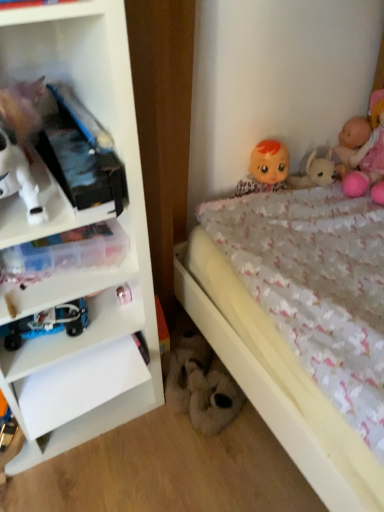
The image size is (384, 512). What do you see at coordinates (199, 384) in the screenshot? I see `fluffy white plush at lower center, the third toy when ordered from front to back` at bounding box center [199, 384].

Identify the location of metallic silver toy at lower left, marked as the 2th toy in a front-to-back arrangement. The width and height of the screenshot is (384, 512). 124,294.

What do you see at coordinates (124, 294) in the screenshot? I see `metallic silver toy at lower left, which appears as the second toy when viewed from the left` at bounding box center [124, 294].

The width and height of the screenshot is (384, 512). Describe the element at coordinates (350, 143) in the screenshot. I see `smooth pink doll at upper right, which is counted as the second doll, starting from the right` at that location.

What do you see at coordinates (266, 168) in the screenshot?
I see `smooth plastic doll at upper right, which is the 1th doll in left-to-right order` at bounding box center [266, 168].

Describe the element at coordinates (97, 265) in the screenshot. I see `white plastic shelf at left` at that location.

Measure the distance between white plastic shelf at left and camera.

They are 23.44 inches apart.

Identify the location of blue metallic car at lower left, arranged as the first toy when viewed from the left. The width and height of the screenshot is (384, 512). (47, 323).

Is metallic silver toy at lower left, the second toy from the right, turned away from smooth plastic doll at upper right, marked as the 3th doll in a right-to-left arrangement?

metallic silver toy at lower left, the second toy from the right, does not have its back to smooth plastic doll at upper right, marked as the 3th doll in a right-to-left arrangement.

Are metallic silver toy at lower left, the 3th toy from the bottom, and smooth plastic doll at upper right, which is the 1th doll in left-to-right order, beside each other?

No, metallic silver toy at lower left, the 3th toy from the bottom, is not in contact with smooth plastic doll at upper right, which is the 1th doll in left-to-right order.

Can you confirm if metallic silver toy at lower left, marked as the 2th toy in a front-to-back arrangement, is bigger than smooth plastic doll at upper right, marked as the 3th doll in a right-to-left arrangement?

Incorrect, metallic silver toy at lower left, marked as the 2th toy in a front-to-back arrangement, is not larger than smooth plastic doll at upper right, marked as the 3th doll in a right-to-left arrangement.

Is metallic silver toy at lower left, the second toy from the right, inside or outside of smooth plastic doll at upper right, which is the 1th doll in left-to-right order?

metallic silver toy at lower left, the second toy from the right, cannot be found inside smooth plastic doll at upper right, which is the 1th doll in left-to-right order.

Does point (119, 293) come farther from viewer compared to point (342, 151)?

No.

You are a GUI agent. You are given a task and a screenshot of the screen. Output one action in this format:
    pyautogui.click(x=<x>, y=<y>)
    Task: Click on the 1st toy positioned below the smooth pink doll at upper right, the second doll when ordered from left to right (from the image's perspective)
    The image size is (384, 512).
    Given the screenshot: What is the action you would take?
    pyautogui.click(x=124, y=294)

Which object is closer to the camera taking this photo, metallic silver toy at lower left, the 3th toy from the bottom, or smooth pink doll at upper right, which is counted as the second doll, starting from the right?

metallic silver toy at lower left, the 3th toy from the bottom, is in front.

In terms of height, does metallic silver toy at lower left, which appears as the second toy when viewed from the left, look taller or shorter compared to smooth pink doll at upper right, the second doll when ordered from left to right?

Considering their sizes, metallic silver toy at lower left, which appears as the second toy when viewed from the left, has less height than smooth pink doll at upper right, the second doll when ordered from left to right.

Is smooth pink doll at upper right, the second doll when ordered from left to right, with white plastic shelf at left?

No, smooth pink doll at upper right, the second doll when ordered from left to right, is not beside white plastic shelf at left.

Is smooth pink doll at upper right, the second doll when ordered from left to right, oriented towards white plastic shelf at left?

Yes, smooth pink doll at upper right, the second doll when ordered from left to right, is oriented towards white plastic shelf at left.

Which doll is the 3rd one when counting from the back of the white plastic shelf at left? Please provide its 2D coordinates.

[(350, 143)]

Where is `the 1st toy to the left of the smooth plastic doll at upper right, marked as the 3th doll in a right-to-left arrangement, starting your count from the anchor`? The width and height of the screenshot is (384, 512). the 1st toy to the left of the smooth plastic doll at upper right, marked as the 3th doll in a right-to-left arrangement, starting your count from the anchor is located at coordinates (199, 384).

Is smooth plastic doll at upper right, which is the 1th doll in left-to-right order, situated inside fluffy white plush at lower center, the first toy from the right, or outside?

smooth plastic doll at upper right, which is the 1th doll in left-to-right order, is not inside fluffy white plush at lower center, the first toy from the right, it's outside.

Which of these two, smooth plastic doll at upper right, which is the 1th doll in left-to-right order, or fluffy white plush at lower center, which ranks as the 3th toy in left-to-right order, is thinner?

smooth plastic doll at upper right, which is the 1th doll in left-to-right order.

Between point (255, 170) and point (225, 382), which one is positioned in front?

Point (225, 382)

Could white plastic shelf at left be considered to be inside fluffy white plush at lower center, the third toy when ordered from front to back?

No, white plastic shelf at left is not a part of fluffy white plush at lower center, the third toy when ordered from front to back.

Is fluffy white plush at lower center, the 1th toy positioned from the back, with white plastic shelf at left?

No, fluffy white plush at lower center, the 1th toy positioned from the back, is not making contact with white plastic shelf at left.

Does point (197, 411) appear closer or farther from the camera than point (120, 372)?

Clearly, point (197, 411) is more distant from the camera than point (120, 372).

Visually, is blue metallic car at lower left, arranged as the first toy when viewed from the left, positioned to the left or to the right of smooth plastic doll at upper right, which is the 1th doll in left-to-right order?

Based on their positions, blue metallic car at lower left, arranged as the first toy when viewed from the left, is located to the left of smooth plastic doll at upper right, which is the 1th doll in left-to-right order.

This screenshot has width=384, height=512. I want to click on the 2nd toy below the smooth plastic doll at upper right, marked as the 3th doll in a right-to-left arrangement (from the image's perspective), so click(47, 323).

Can you confirm if blue metallic car at lower left, which ranks as the second toy in top-to-bottom order, is wider than smooth plastic doll at upper right, marked as the 3th doll in a right-to-left arrangement?

No, blue metallic car at lower left, which ranks as the second toy in top-to-bottom order, is not wider than smooth plastic doll at upper right, marked as the 3th doll in a right-to-left arrangement.

Considering the positions of objects blue metallic car at lower left, the second toy in the bottom-to-top sequence, and smooth plastic doll at upper right, which is the 1th doll in left-to-right order, in the image provided, who is in front, blue metallic car at lower left, the second toy in the bottom-to-top sequence, or smooth plastic doll at upper right, which is the 1th doll in left-to-right order,?

blue metallic car at lower left, the second toy in the bottom-to-top sequence, is more forward.

The width and height of the screenshot is (384, 512). I want to click on toy that is the 1st one when counting forward from the smooth pink doll at upper right, which is counted as the second doll, starting from the right, so click(199, 384).

In the scene shown: Is smooth pink doll at upper right, which is counted as the second doll, starting from the right, thinner than fluffy white plush at lower center, the first toy from the right?

Incorrect, the width of smooth pink doll at upper right, which is counted as the second doll, starting from the right, is not less than that of fluffy white plush at lower center, the first toy from the right.

Consider the image. Between smooth pink doll at upper right, which is counted as the second doll, starting from the right, and fluffy white plush at lower center, the first toy from the right, which one is positioned behind?

Positioned behind is smooth pink doll at upper right, which is counted as the second doll, starting from the right.

Identify the location of the 2nd toy in front of the smooth plastic doll at upper right, which is the 1th doll in left-to-right order. (124, 294).

From the metallic silver toy at lower left, the 1th toy viewed from the top, count 2nd doll to the right and point to it. Please provide its 2D coordinates.

[(350, 143)]

Looking at the image, which one is located further to smooth plastic doll at upper right, which is the 1th doll in left-to-right order, white plastic shelf at left or blue metallic car at lower left, the third toy from the right?

blue metallic car at lower left, the third toy from the right.

Looking at the image, which one is located closer to metallic silver toy at lower left, which appears as the second toy when viewed from the back, white plastic shelf at left or blue metallic car at lower left, the third toy from the right?

blue metallic car at lower left, the third toy from the right, is closer to metallic silver toy at lower left, which appears as the second toy when viewed from the back.

Estimate the real-world distances between objects in this image. Which object is closer to fluffy white plush at lower center, the 3th toy from the top, smooth pink doll at upper right, the second doll when ordered from left to right, or blue metallic car at lower left, the third toy from the right?

Among the two, blue metallic car at lower left, the third toy from the right, is located nearer to fluffy white plush at lower center, the 3th toy from the top.

When comparing their distances from smooth pink doll at upper right, which is counted as the second doll, starting from the right, does fluffy white plush at lower center, the 1th toy positioned from the back, or white plastic shelf at left seem closer?

The object closer to smooth pink doll at upper right, which is counted as the second doll, starting from the right, is fluffy white plush at lower center, the 1th toy positioned from the back.

Considering their positions, is metallic silver toy at lower left, marked as the 2th toy in a front-to-back arrangement, positioned closer to blue metallic car at lower left, the second toy in the bottom-to-top sequence, than smooth plastic doll at upper right, which is the 1th doll in left-to-right order?

metallic silver toy at lower left, marked as the 2th toy in a front-to-back arrangement, is closer to blue metallic car at lower left, the second toy in the bottom-to-top sequence.

In the scene shown: Looking at the image, which one is located closer to fluffy white plush at lower center, the first toy from the right, smooth plastic doll at upper right, marked as the 3th doll in a right-to-left arrangement, or blue metallic car at lower left, which is the 1th toy from front to back?

blue metallic car at lower left, which is the 1th toy from front to back, lies closer to fluffy white plush at lower center, the first toy from the right, than the other object.

Based on their spatial positions, is smooth pink doll at upper right, which is counted as the second doll, starting from the right, or pink plush doll at upper right, the third doll viewed from the left, further from fluffy white plush at lower center, which ranks as the 3th toy in left-to-right order?

smooth pink doll at upper right, which is counted as the second doll, starting from the right, is positioned further to the anchor fluffy white plush at lower center, which ranks as the 3th toy in left-to-right order.

From the image, which object appears to be farther from white plastic shelf at left, smooth pink doll at upper right, the second doll when ordered from left to right, or fluffy white plush at lower center, the first toy from the bottom?

Among the two, smooth pink doll at upper right, the second doll when ordered from left to right, is located further to white plastic shelf at left.

Find the location of a particular element. toy between white plastic shelf at left and metallic silver toy at lower left, which appears as the second toy when viewed from the back, from front to back is located at coordinates (47, 323).

What are the coordinates of `toy between blue metallic car at lower left, which is the 1th toy from front to back, and fluffy white plush at lower center, the 3th toy from the top, from left to right` in the screenshot? It's located at [124, 294].

Where is `doll between metallic silver toy at lower left, which appears as the second toy when viewed from the left, and smooth pink doll at upper right, the second doll when ordered from left to right, in the horizontal direction`? The height and width of the screenshot is (512, 384). doll between metallic silver toy at lower left, which appears as the second toy when viewed from the left, and smooth pink doll at upper right, the second doll when ordered from left to right, in the horizontal direction is located at coordinates (266, 168).

Image resolution: width=384 pixels, height=512 pixels. Identify the location of doll between smooth plastic doll at upper right, marked as the 3th doll in a right-to-left arrangement, and pink plush doll at upper right, the third doll viewed from the left, in the horizontal direction. (350, 143).